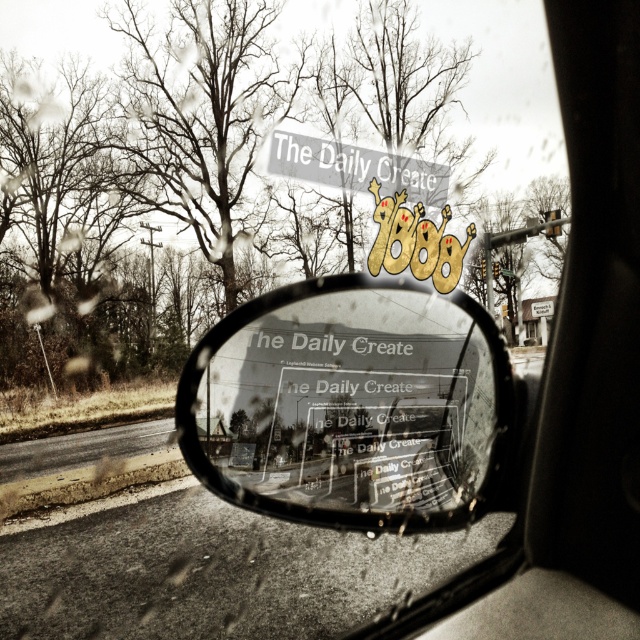
You are a driver checking your side mirror and notice two objects in the reflection. Which object would appear bigger in the reflection between the transparent glass mirror at center and the gray matte sign at upper center?

The transparent glass mirror at center appears bigger in the reflection than the gray matte sign at upper center because it is larger in size.

You are a driver who just noticed a water droplet on the transparent glass mirror at center. If you want to wipe it off, where exactly should you aim your cloth?

You should aim your cloth at point (349, 404) on the transparent glass mirror at center to remove the water droplet.